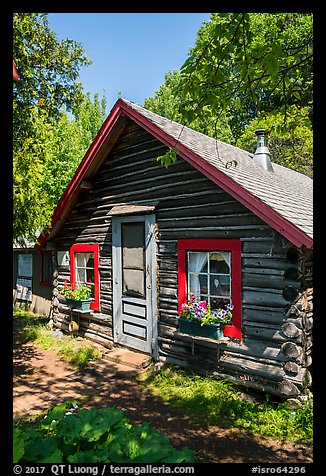
At what (x,y) coordinates should I click in order to perform the action: click on light blue window planter box. Please return your answer as a coordinate pair (x, y). Image resolution: width=326 pixels, height=476 pixels. Looking at the image, I should click on (80, 305).